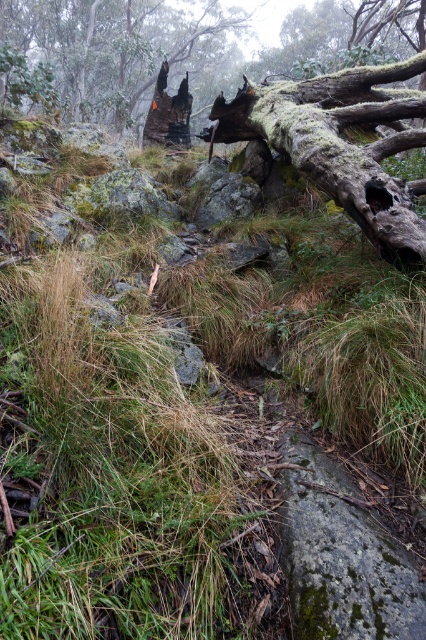
Question: Where is mossy bark tree trunk at upper center located in relation to charcoal burnt tree stump at upper center in the image?

Choices:
 (A) right
 (B) left

Answer: (A)

Question: Is mossy bark tree trunk at upper center behind charcoal burnt tree stump at upper center?

Choices:
 (A) yes
 (B) no

Answer: (B)

Question: Which point is farther from the camera taking this photo?

Choices:
 (A) (100, 67)
 (B) (310, 83)

Answer: (A)

Question: Can you confirm if mossy bark tree trunk at upper center is bigger than charcoal burnt tree stump at upper center?

Choices:
 (A) no
 (B) yes

Answer: (A)

Question: Which point is farther from the camera taking this photo?

Choices:
 (A) (91, 72)
 (B) (247, 84)

Answer: (A)

Question: Which point is closer to the camera?

Choices:
 (A) (213, 134)
 (B) (149, 22)

Answer: (A)